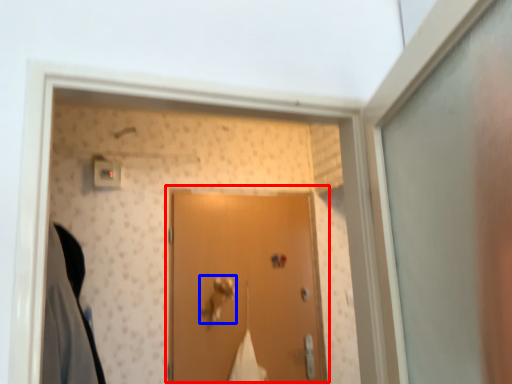
Question: Which of the following is the farthest to the observer, door (highlighted by a red box) or door handle (highlighted by a blue box)?

Choices:
 (A) door
 (B) door handle

Answer: (B)